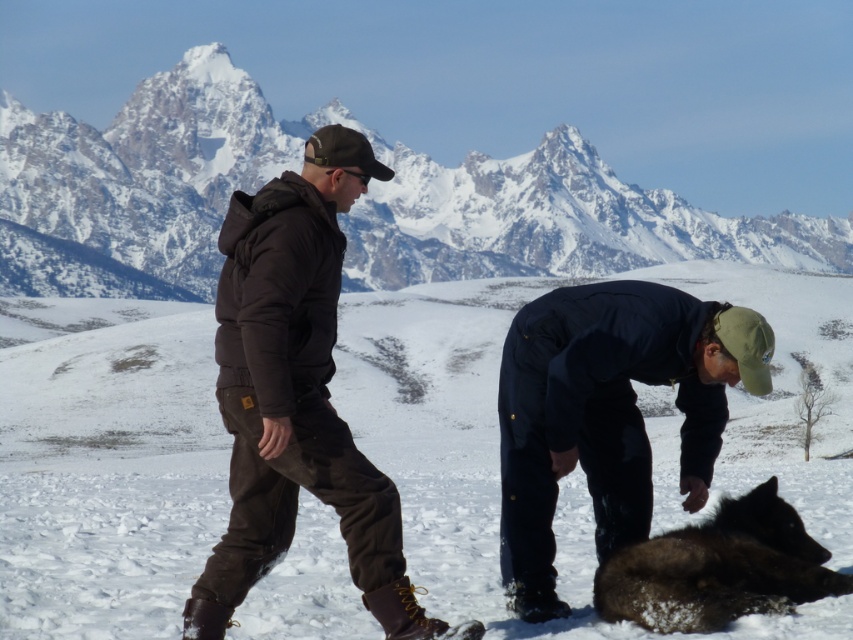
You are standing in the winter landscape and want to take a photo of the snowy granite mountain at upper center and the matte black jacket at center. Which object should you focus on first if you want to capture both in the same frame?

The snowy granite mountain at upper center is positioned on the right side of matte black jacket at center. To capture both in the same frame, focus on the matte black jacket at center first as it is closer to you, then adjust the camera to include the snowy granite mountain at upper center on the right side.

You are a photographer standing in the winter landscape. You see the dark blue fabric jacket at lower right and the dark brown fur at lower right. Which object is positioned higher in the image?

The dark blue fabric jacket at lower right is above the dark brown fur at lower right in the image.

You are standing at the viewpoint and want to reach point (361, 561). Is the distance more than 50 meters?

Yes, the distance between point (361, 561) and the viewer is 69.34 meters, which is more than 50 meters.